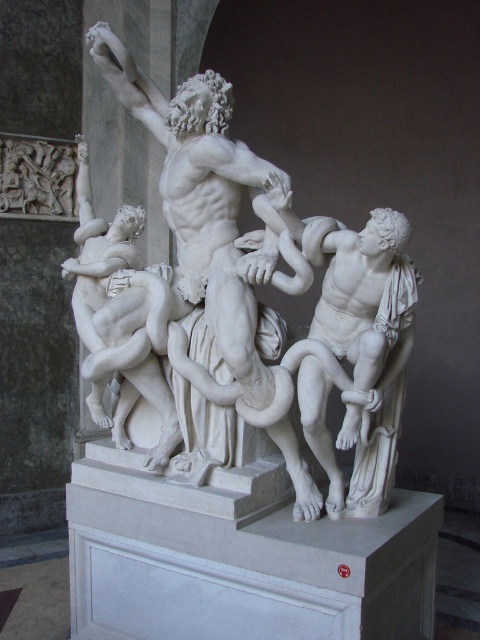
Can you confirm if white marble sculpture at center is thinner than white marble figure at right?

No.

Can you confirm if white marble sculpture at center is positioned below white marble figure at right?

Incorrect, white marble sculpture at center is not positioned below white marble figure at right.

Find the location of `white marble sculpture at center`. white marble sculpture at center is located at coordinates (250, 312).